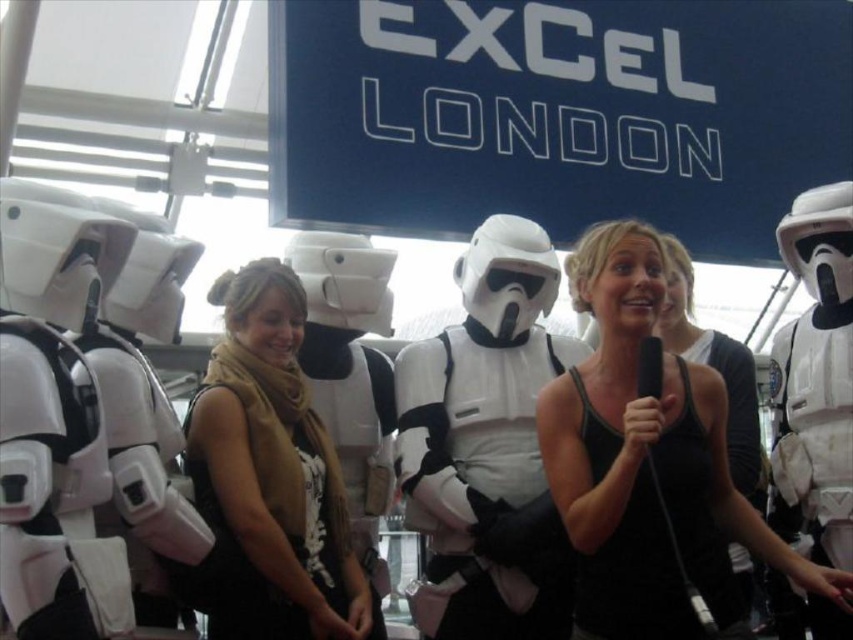
You are a photographer trying to capture a clear shot of both the black tank top at center and the white matte stormtrooper armor at center. Since you want to ensure both are fully visible in your frame, which object should you focus on first to account for their size difference?

The black tank top at center has a greater height compared to the white matte stormtrooper armor at center, so you should focus on the black tank top at center first to ensure its full height is captured before adjusting the frame for the smaller white matte stormtrooper armor at center.

You are standing in the convention hall and see the black tank top at center and the tan scarf at center. Which object is closer to you?

The black tank top at center is closer to you because it is further to the viewer than the tan scarf at center.

In the scene shown: You are attending a costume party and notice two items at the center of the scene. The black tank top at center and the tan scarf at center. Which item takes up more space in the image?

The black tank top at center is larger in size than the tan scarf at center, so it takes up more space in the image.